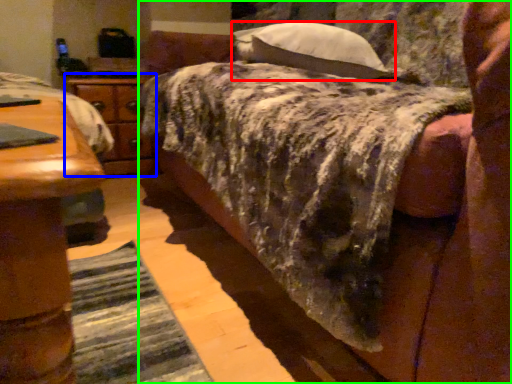
Question: Considering the real-world distances, which object is closest to pillow (highlighted by a red box)? nightstand (highlighted by a blue box) or bed (highlighted by a green box).

Choices:
 (A) nightstand
 (B) bed

Answer: (B)